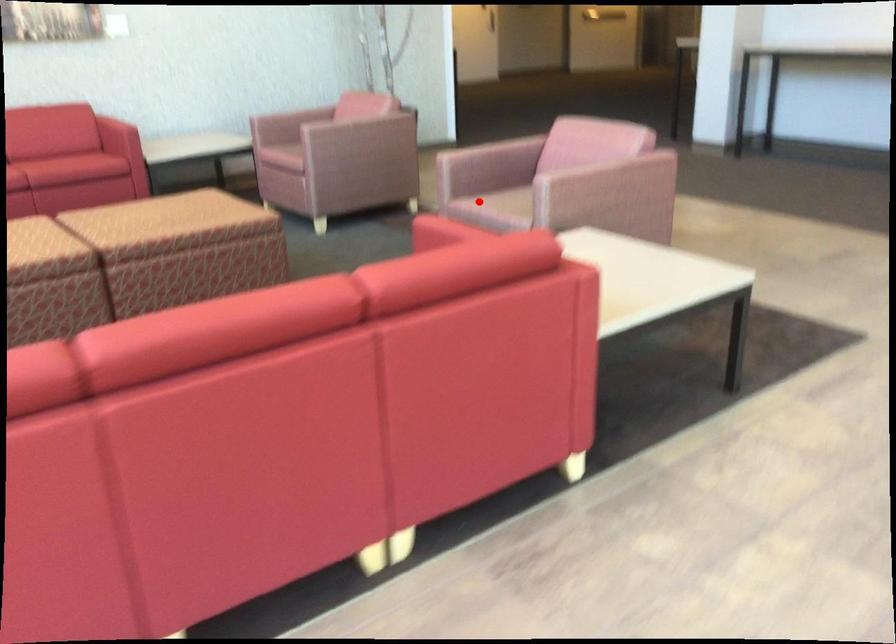
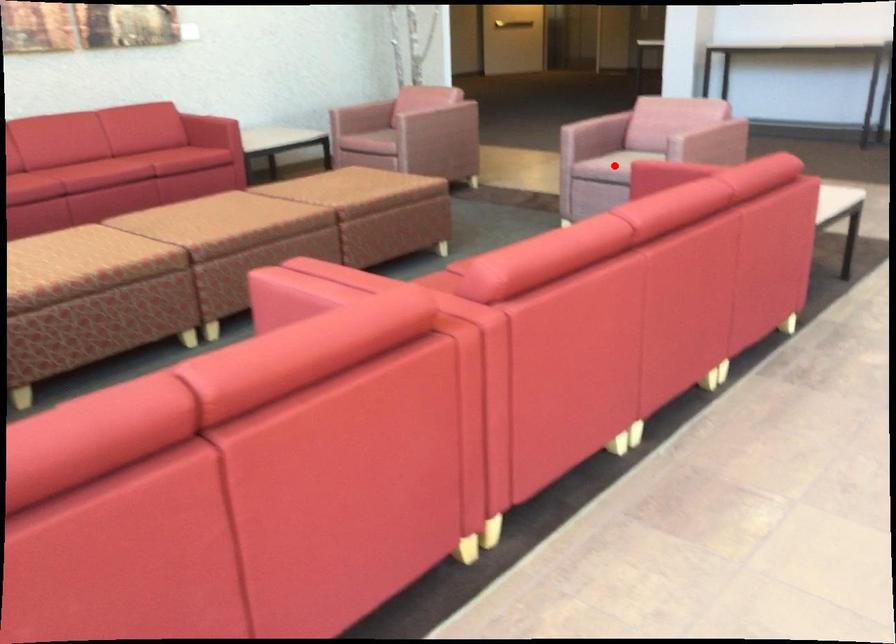
I am providing you with two images of the same scene from different viewpoints. A red point is marked on the first image and another point is marked on the second image. Is the red point in image1 aligned with the point shown in image2?

Yes